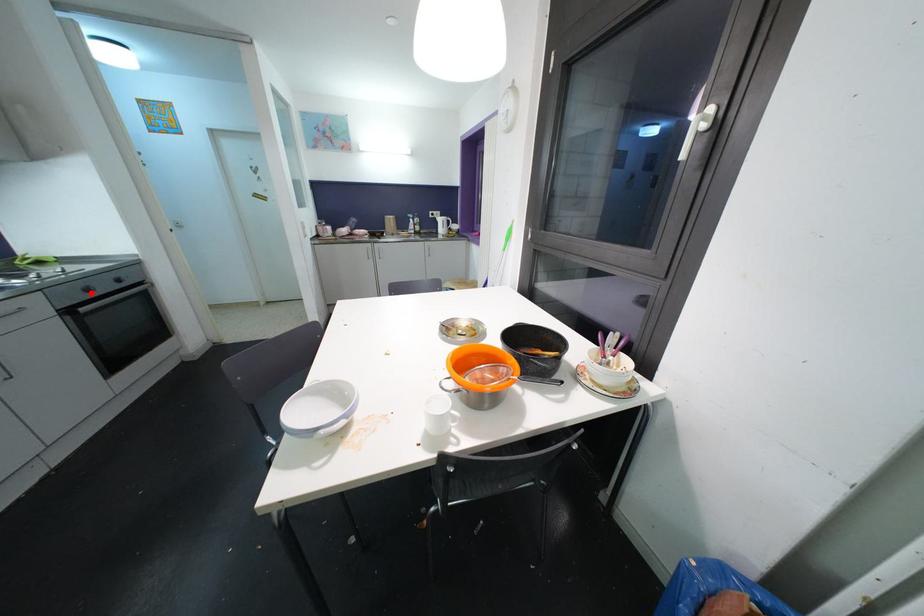
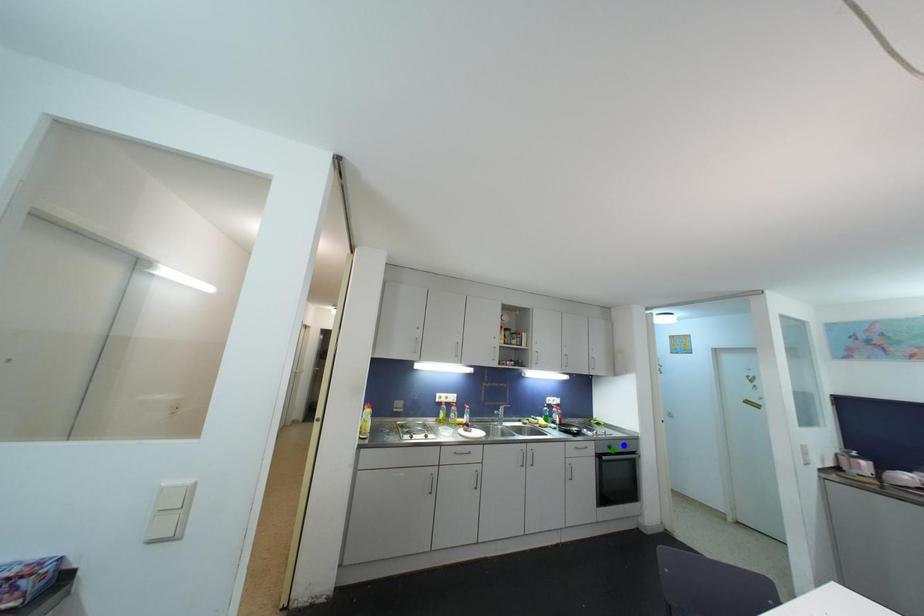
Question: I am providing you with two images of the same scene from different viewpoints. A red point is marked on the first image. You are given multiple points on the second image. Which mark in image 2 goes with the point in image 1?

Choices:
 (A) yellow point
 (B) blue point
 (C) green point

Answer: (C)